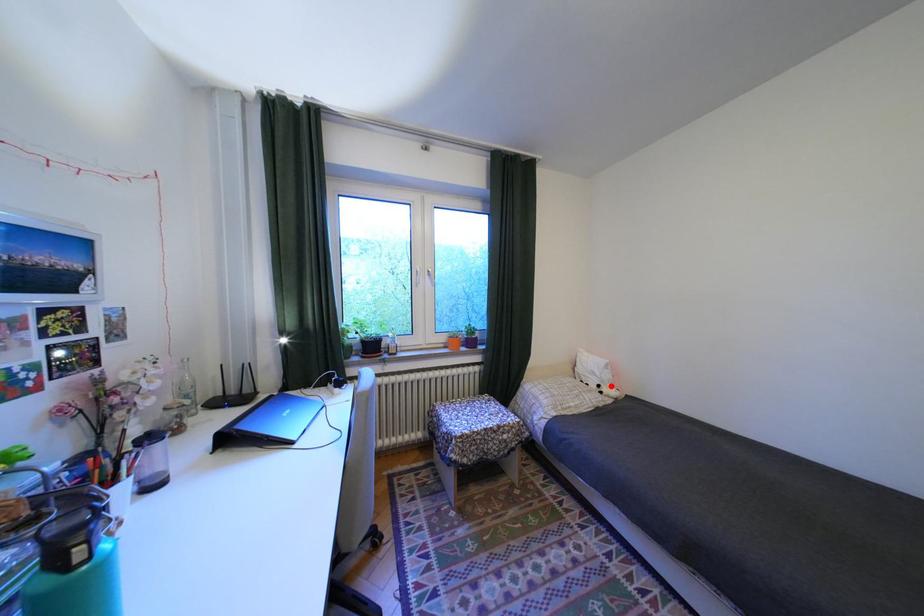
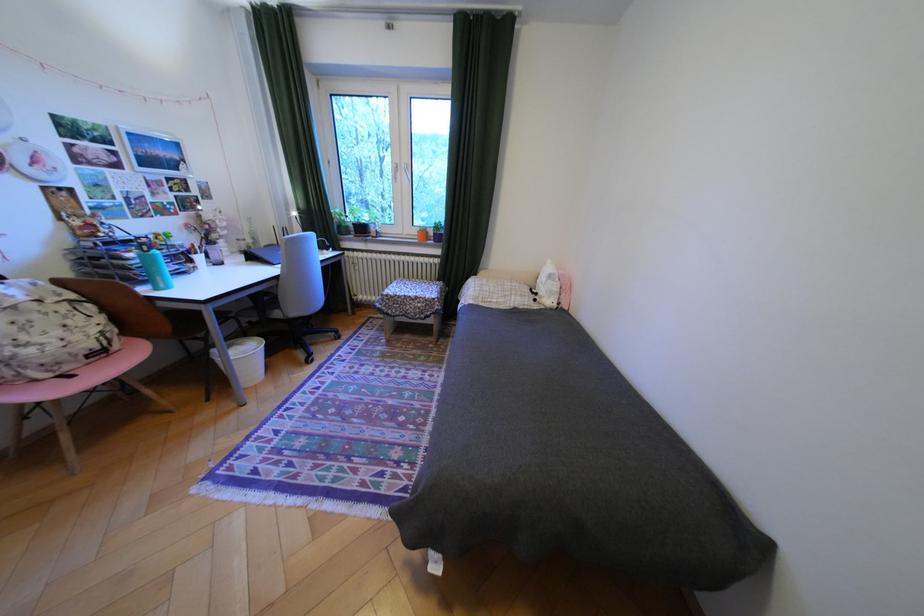
Where in the second image is the point corresponding to the highlighted location from the first image?

(548, 294)